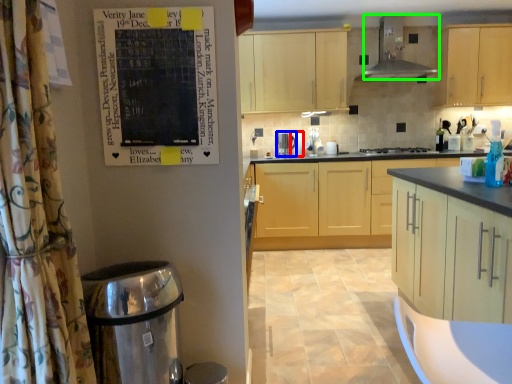
Question: Considering the real-world distances, which object is closest to appliance (highlighted by a red box)? kitchen appliance (highlighted by a blue box) or home appliance (highlighted by a green box).

Choices:
 (A) kitchen appliance
 (B) home appliance

Answer: (A)